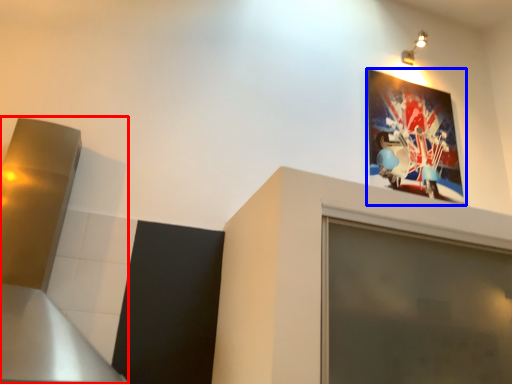
Question: Which point is further to the camera, exhaust hood (highlighted by a red box) or picture frame (highlighted by a blue box)?

Choices:
 (A) exhaust hood
 (B) picture frame

Answer: (B)